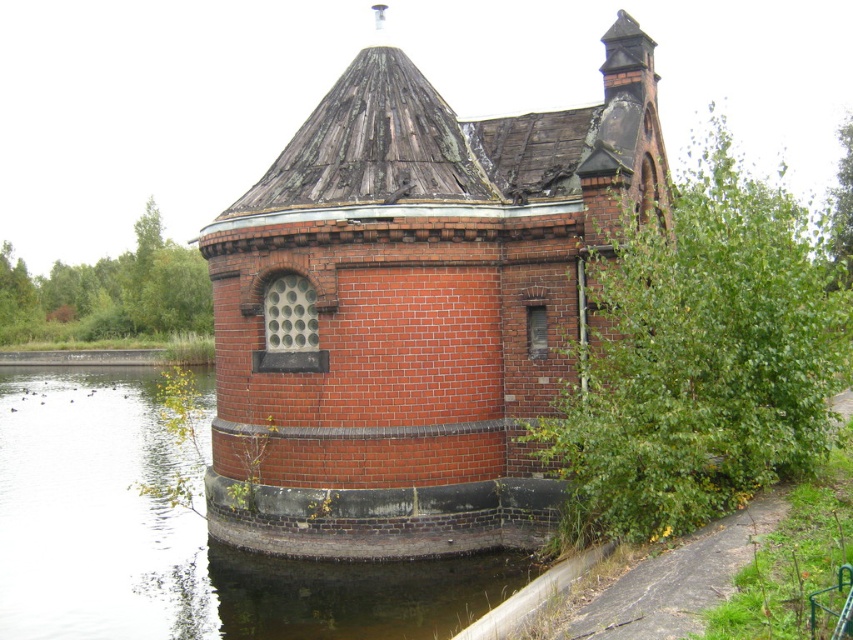
Question: Is red brick tower at center wider than clear water at lower left?

Choices:
 (A) no
 (B) yes

Answer: (A)

Question: Does red brick tower at center have a greater width compared to clear water at lower left?

Choices:
 (A) no
 (B) yes

Answer: (A)

Question: Is the position of red brick tower at center less distant than that of clear water at lower left?

Choices:
 (A) no
 (B) yes

Answer: (A)

Question: Which object appears closest to the camera in this image?

Choices:
 (A) clear water at lower left
 (B) red brick tower at center

Answer: (A)